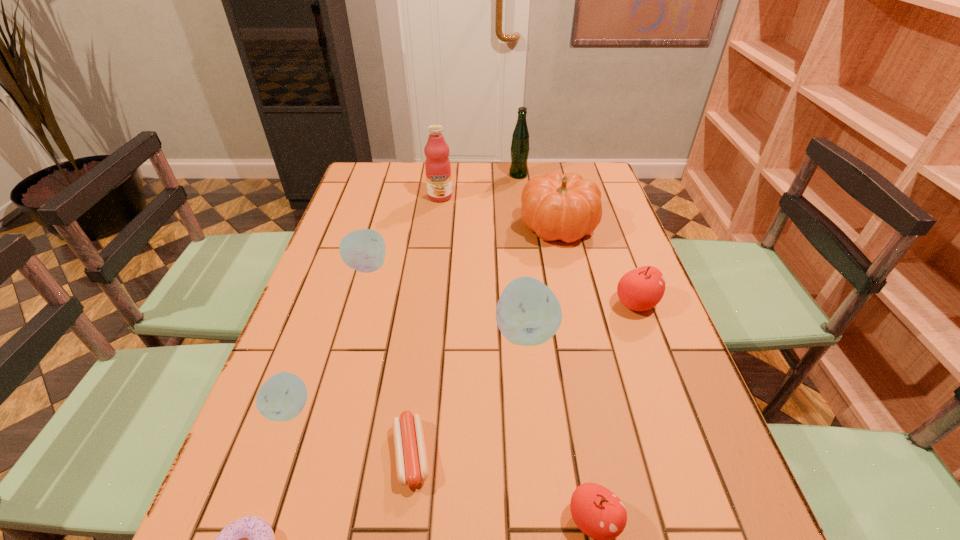
The width and height of the screenshot is (960, 540). What are the coordinates of `free space at the near right corner of the desktop` in the screenshot? It's located at 686,537.

Locate an element on the screen. vacant space that's between the nearest white apple and the right red apple is located at coordinates (463, 356).

Identify the location of vacant area that lies between the second nearest white apple and the pink fruit juice. click(483, 264).

Image resolution: width=960 pixels, height=540 pixels. In order to click on free spot between the seventh nearest object and the orange pumpkin in this screenshot , I will do `click(463, 246)`.

Identify the location of free space between the brown sausage and the fourth farthest apple. (350, 431).

The height and width of the screenshot is (540, 960). I want to click on empty space that is in between the pink fruit juice and the pumpkin, so click(499, 211).

At what (x,y) coordinates should I click in order to perform the action: click on vacant space in between the fourth farthest apple and the ninth nearest object. Please return your answer as a coordinate pair (x, y). Looking at the image, I should click on (365, 302).

Locate an element on the screen. free spot between the second farthest object and the farthest apple is located at coordinates (403, 232).

Identify the location of object that is the ninth closest to the rightmost white apple. (520, 148).

Select which object is the seventh closest to the green beer bottle. Please provide its 2D coordinates. Your answer should be formatted as a tuple, i.e. [(x, y)], where the tuple contains the x and y coordinates of a point satisfying the conditions above.

[(282, 397)]